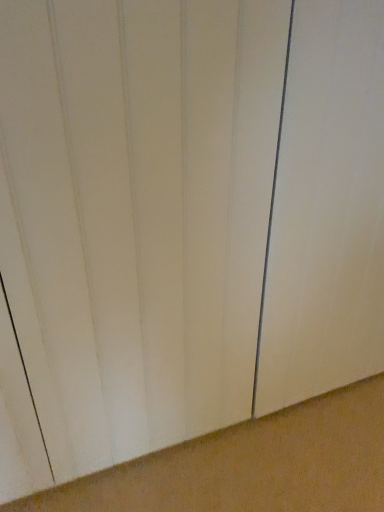
The height and width of the screenshot is (512, 384). Find the location of `brown matte concrete at bottom`. brown matte concrete at bottom is located at coordinates (251, 465).

This screenshot has width=384, height=512. What do you see at coordinates (251, 465) in the screenshot?
I see `brown matte concrete at bottom` at bounding box center [251, 465].

The image size is (384, 512). Identify the location of brown matte concrete at bottom. (251, 465).